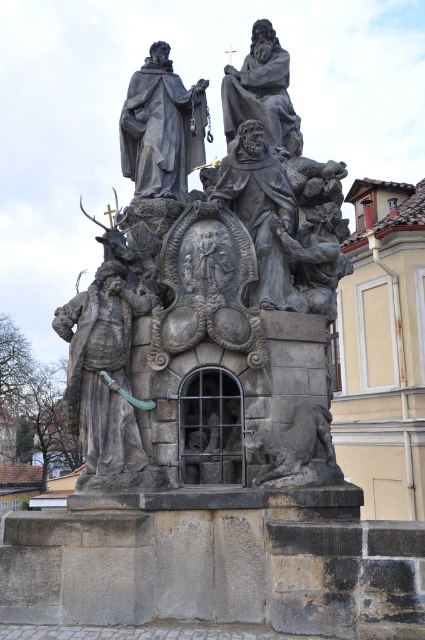
Question: Which object is positioned closest to the polished bronze statue at upper center?

Choices:
 (A) polished stone statue at center
 (B) polished bronze figure at lower left

Answer: (A)

Question: Can you confirm if polished stone statue at center is thinner than polished stone figure at center?

Choices:
 (A) no
 (B) yes

Answer: (A)

Question: Is matte gray statue at upper center to the right of polished stone figure at center from the viewer's perspective?

Choices:
 (A) no
 (B) yes

Answer: (A)

Question: Is polished stone statue at center to the right of polished stone figure at center from the viewer's perspective?

Choices:
 (A) yes
 (B) no

Answer: (B)

Question: Which object is the farthest from the polished bronze figure at lower left?

Choices:
 (A) matte gray statue at upper center
 (B) polished stone figure at center
 (C) polished stone statue at center
 (D) gray stone lion at lower center

Answer: (A)

Question: Which of the following is the farthest from the observer?

Choices:
 (A) gray stone lion at lower center
 (B) matte gray statue at upper center

Answer: (B)